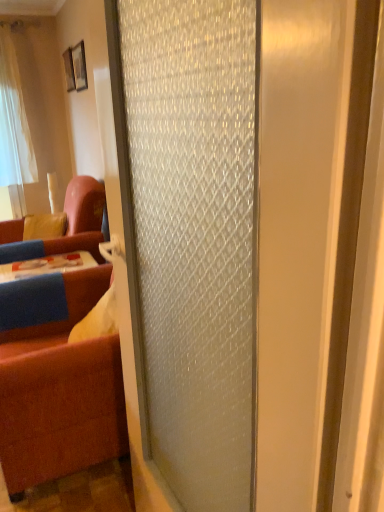
Question: Is wooden picture frame at upper left, marked as the 1th picture frame in a front-to-back arrangement, completely or partially inside brown fabric studio couch at left, the second studio couch in the back-to-front sequence?

Choices:
 (A) yes
 (B) no

Answer: (B)

Question: Considering the relative sizes of brown fabric studio couch at left, the second studio couch in the back-to-front sequence, and wooden picture frame at upper left, marked as the 1th picture frame in a front-to-back arrangement, in the image provided, is brown fabric studio couch at left, the second studio couch in the back-to-front sequence, thinner than wooden picture frame at upper left, marked as the 1th picture frame in a front-to-back arrangement,?

Choices:
 (A) yes
 (B) no

Answer: (B)

Question: Is brown fabric studio couch at left, the second studio couch in the back-to-front sequence, positioned in front of wooden picture frame at upper left, which is the 2th picture frame in back-to-front order?

Choices:
 (A) no
 (B) yes

Answer: (B)

Question: Is brown fabric studio couch at left, the second studio couch in the back-to-front sequence, taller than wooden picture frame at upper left, arranged as the second picture frame when viewed from the left?

Choices:
 (A) yes
 (B) no

Answer: (A)

Question: Is brown fabric studio couch at left, the second studio couch in the back-to-front sequence, smaller than wooden picture frame at upper left, marked as the 1th picture frame in a front-to-back arrangement?

Choices:
 (A) yes
 (B) no

Answer: (B)

Question: From a real-world perspective, is frosted glass door at center physically located above or below wooden picture frame at upper left, arranged as the first picture frame when viewed from the back?

Choices:
 (A) above
 (B) below

Answer: (B)

Question: Is point (329, 389) positioned closer to the camera than point (71, 60)?

Choices:
 (A) farther
 (B) closer

Answer: (B)

Question: In the image, is frosted glass door at center positioned in front of or behind wooden picture frame at upper left, which ranks as the 1th picture frame in left-to-right order?

Choices:
 (A) behind
 (B) front

Answer: (B)

Question: Considering the positions of frosted glass door at center and wooden picture frame at upper left, arranged as the first picture frame when viewed from the back, in the image, is frosted glass door at center taller or shorter than wooden picture frame at upper left, arranged as the first picture frame when viewed from the back,?

Choices:
 (A) tall
 (B) short

Answer: (A)

Question: From a real-world perspective, is velvet blue couch at left, which is counted as the 2th studio couch, starting from the front, above or below wooden picture frame at upper left, marked as the 1th picture frame in a front-to-back arrangement?

Choices:
 (A) above
 (B) below

Answer: (B)

Question: Is velvet blue couch at left, acting as the first studio couch starting from the back, wider or thinner than wooden picture frame at upper left, which is the 2th picture frame in back-to-front order?

Choices:
 (A) thin
 (B) wide

Answer: (B)

Question: From their relative heights in the image, would you say velvet blue couch at left, acting as the first studio couch starting from the back, is taller or shorter than wooden picture frame at upper left, marked as the 1th picture frame in a front-to-back arrangement?

Choices:
 (A) tall
 (B) short

Answer: (A)

Question: Would you say velvet blue couch at left, acting as the first studio couch starting from the back, is to the left or to the right of wooden picture frame at upper left, the 1th picture frame from the right, in the picture?

Choices:
 (A) left
 (B) right

Answer: (A)

Question: From a real-world perspective, is velvet blue couch at left, acting as the first studio couch starting from the back, physically located above or below brown fabric studio couch at left, which is counted as the 1th studio couch, starting from the front?

Choices:
 (A) below
 (B) above

Answer: (B)

Question: Looking at the image, does velvet blue couch at left, which is counted as the 2th studio couch, starting from the front, seem bigger or smaller compared to brown fabric studio couch at left, the second studio couch in the back-to-front sequence?

Choices:
 (A) big
 (B) small

Answer: (B)